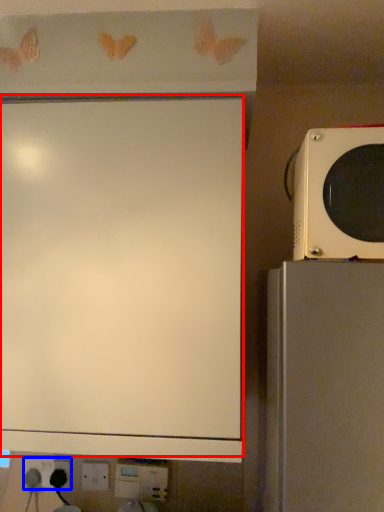
Question: Which object is further to the camera taking this photo, projection screen (highlighted by a red box) or electric outlet (highlighted by a blue box)?

Choices:
 (A) projection screen
 (B) electric outlet

Answer: (B)